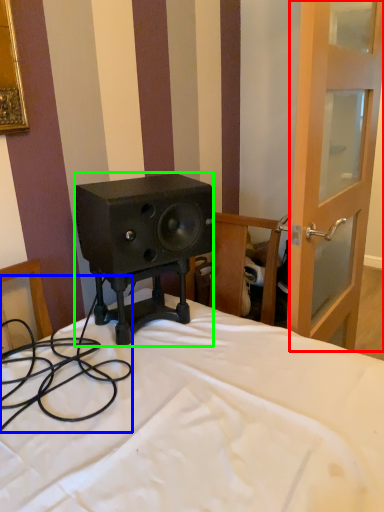
Question: Which object is positioned closest to screen door (highlighted by a red box)? Select from cable (highlighted by a blue box) and loudspeaker (highlighted by a green box).

Choices:
 (A) cable
 (B) loudspeaker

Answer: (B)